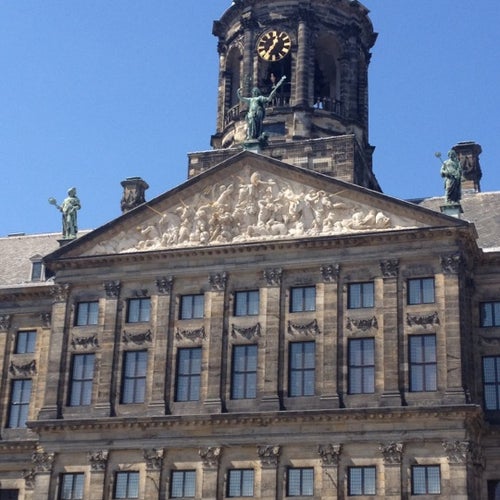
Where is `statue`? This screenshot has height=500, width=500. statue is located at coordinates (68, 208), (257, 112), (455, 186).